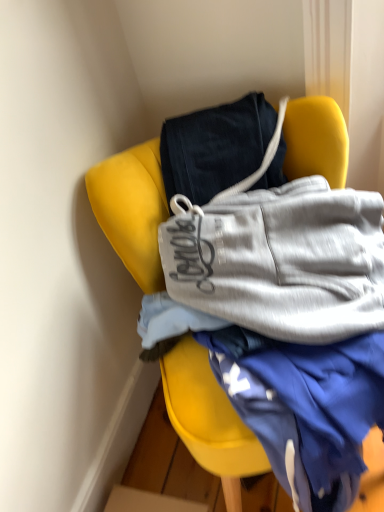
You are a GUI agent. You are given a task and a screenshot of the screen. Output one action in this format:
    pyautogui.click(x=<x>, y=<y>)
    Task: Click on the yellow fabric chair at center
    The width and height of the screenshot is (384, 512).
    Given the screenshot: What is the action you would take?
    pyautogui.click(x=209, y=419)

The image size is (384, 512). Describe the element at coordinates (209, 419) in the screenshot. I see `yellow fabric chair at center` at that location.

Find the location of a particular element. The height and width of the screenshot is (512, 384). yellow fabric chair at center is located at coordinates (209, 419).